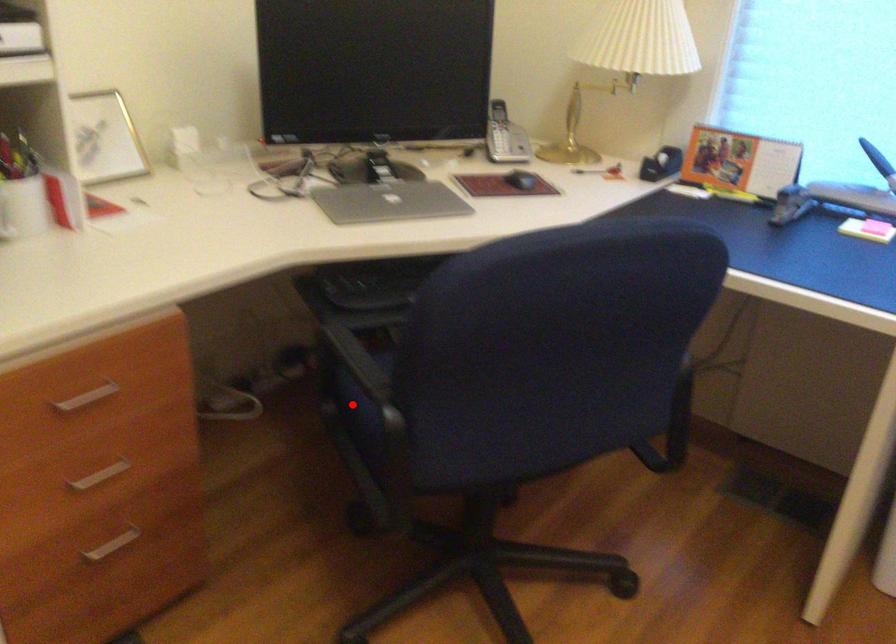
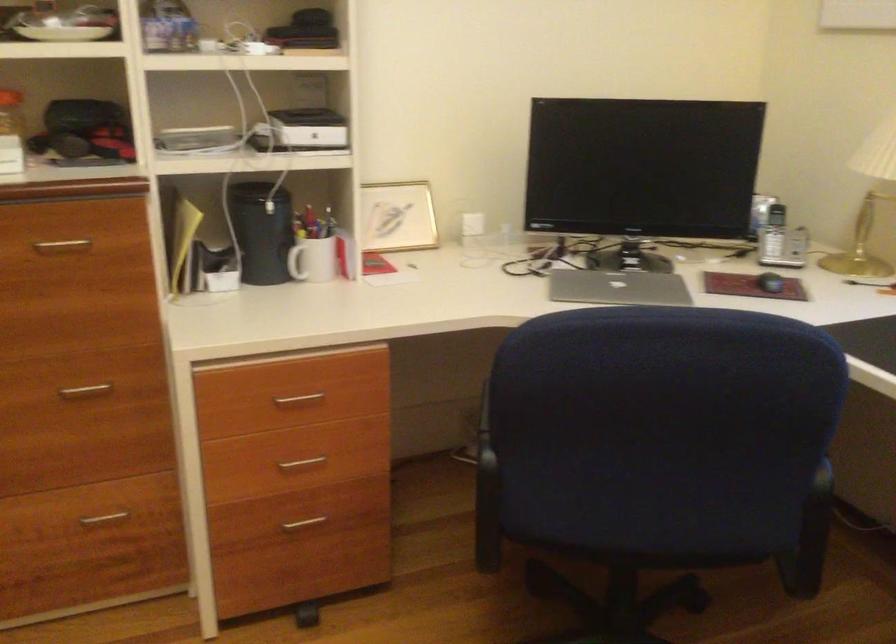
Question: I am providing you with two images of the same scene from different viewpoints. A red point is marked on the first image. Is the red point's position out of view in image 2?

Choices:
 (A) Yes
 (B) No

Answer: (A)